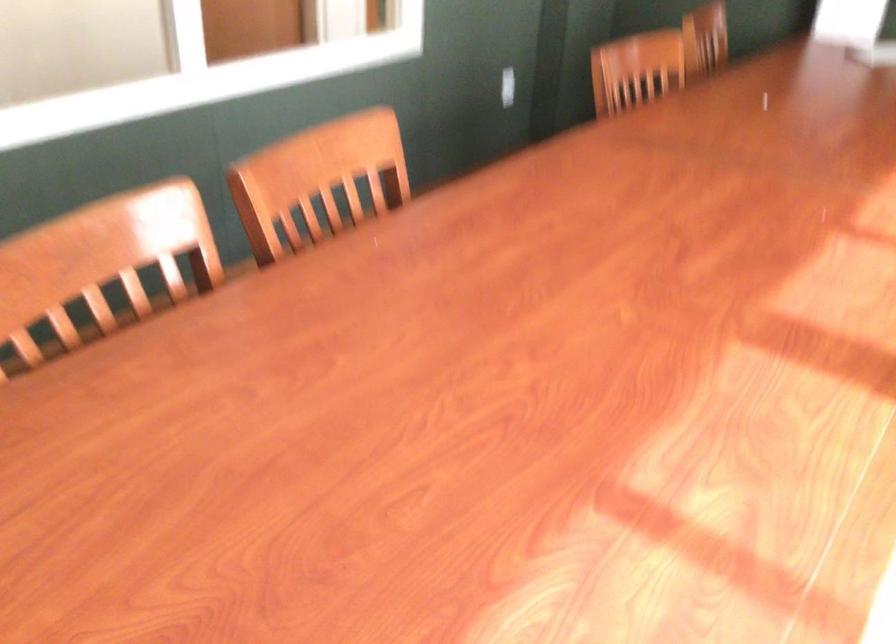
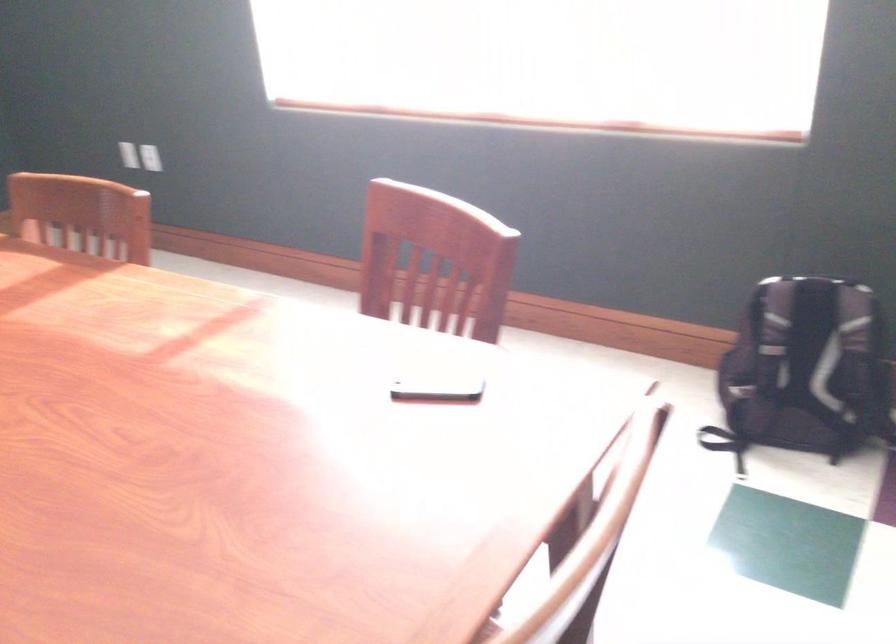
First-person continuous shooting, in which direction is the camera rotating?

The rotation direction of the camera is right-down.